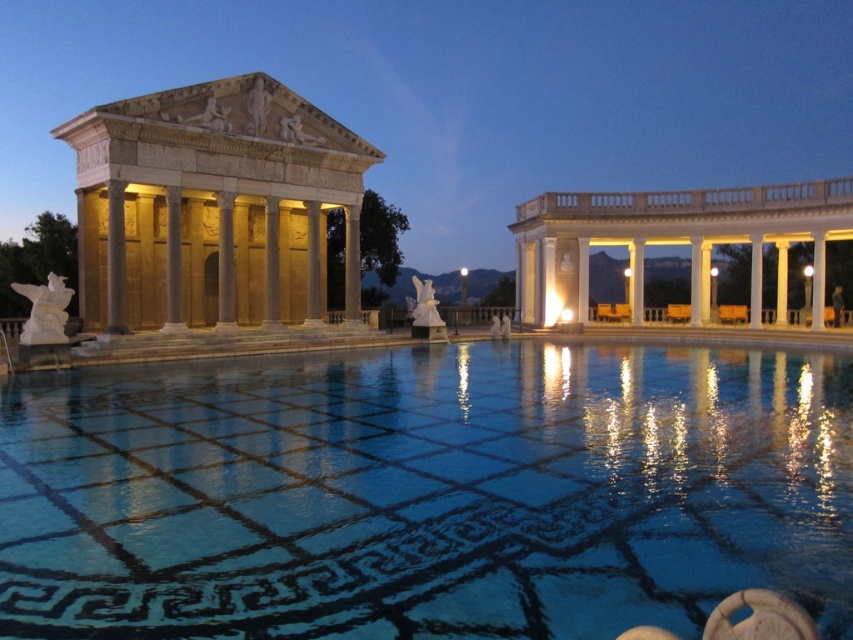
At what (x,y) coordinates should I click in order to perform the action: click on blue glossy water at center. Please return your answer as a coordinate pair (x, y). Looking at the image, I should click on (425, 492).

Does blue glossy water at center have a lesser height compared to light beige stone temple at left?

Correct, blue glossy water at center is not as tall as light beige stone temple at left.

Where is `blue glossy water at center`? blue glossy water at center is located at coordinates (425, 492).

You are a GUI agent. You are given a task and a screenshot of the screen. Output one action in this format:
    pyautogui.click(x=<x>, y=<y>)
    Task: Click on the blue glossy water at center
    The width and height of the screenshot is (853, 640).
    Given the screenshot: What is the action you would take?
    pyautogui.click(x=425, y=492)

Measure the distance between point (131,170) and camera.

Point (131,170) and camera are 35.01 meters apart.

Who is higher up, light beige stone temple at left or white marble columns at right?

light beige stone temple at left is higher up.

Find the location of a particular element. The image size is (853, 640). light beige stone temple at left is located at coordinates (212, 205).

Locate an element on the screen. The height and width of the screenshot is (640, 853). light beige stone temple at left is located at coordinates (212, 205).

Is blue glossy water at center thinner than white marble columns at right?

No, blue glossy water at center is not thinner than white marble columns at right.

Which is below, blue glossy water at center or white marble columns at right?

blue glossy water at center

Between point (86, 497) and point (790, 198), which one is positioned behind?

Point (790, 198)

Locate an element on the screen. blue glossy water at center is located at coordinates (x=425, y=492).